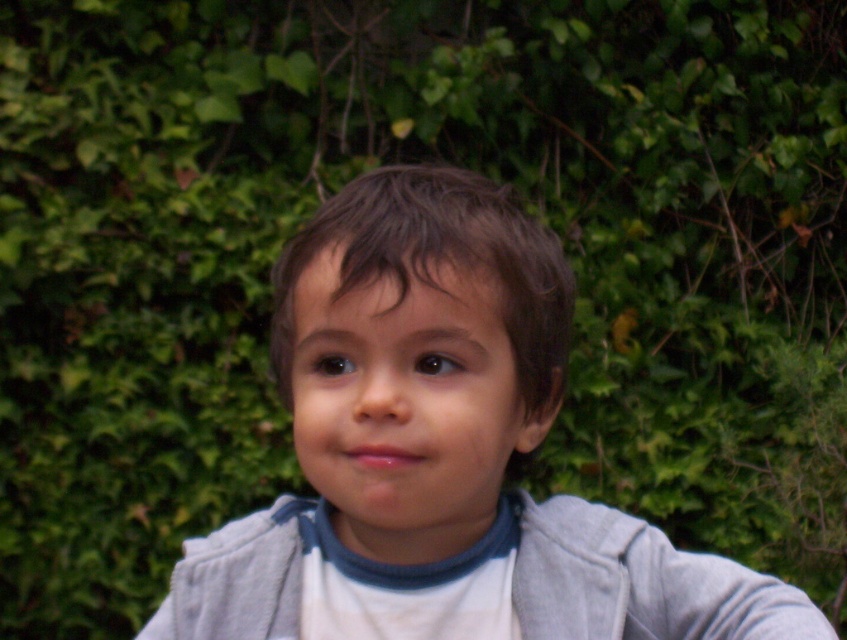
Question: Which point is closer to the camera?

Choices:
 (A) matte gray hoodie at center
 (B) gray fleece jacket at center

Answer: (A)

Question: Which point appears farthest from the camera in this image?

Choices:
 (A) (607, 554)
 (B) (718, 588)

Answer: (A)

Question: Can you confirm if matte gray hoodie at center is bigger than gray fleece jacket at center?

Choices:
 (A) yes
 (B) no

Answer: (A)

Question: Does matte gray hoodie at center have a smaller size compared to gray fleece jacket at center?

Choices:
 (A) yes
 (B) no

Answer: (B)

Question: Which of the following is the farthest from the observer?

Choices:
 (A) (297, 589)
 (B) (272, 513)

Answer: (B)

Question: Is matte gray hoodie at center to the right of gray fleece jacket at center from the viewer's perspective?

Choices:
 (A) yes
 (B) no

Answer: (B)